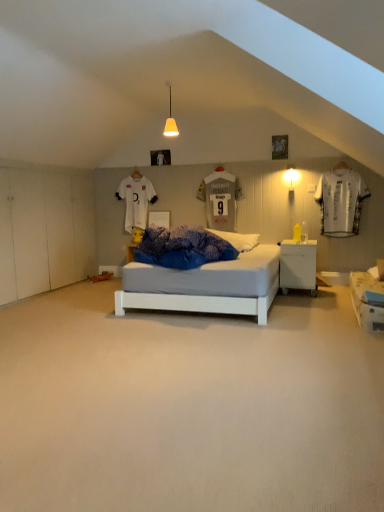
Question: From a real-world perspective, is white jersey at right physically located above or below white glossy nightstand at center?

Choices:
 (A) above
 (B) below

Answer: (A)

Question: In terms of size, does white jersey at right appear bigger or smaller than white glossy nightstand at center?

Choices:
 (A) small
 (B) big

Answer: (A)

Question: Which object is positioned farthest from the white carpet at center?

Choices:
 (A) matte yellow cone at upper center
 (B) white jersey at right
 (C) white glossy nightstand at center

Answer: (B)

Question: Which object is the closest to the white glossy nightstand at center?

Choices:
 (A) white jersey at right
 (B) matte yellow cone at upper center
 (C) white carpet at center

Answer: (A)